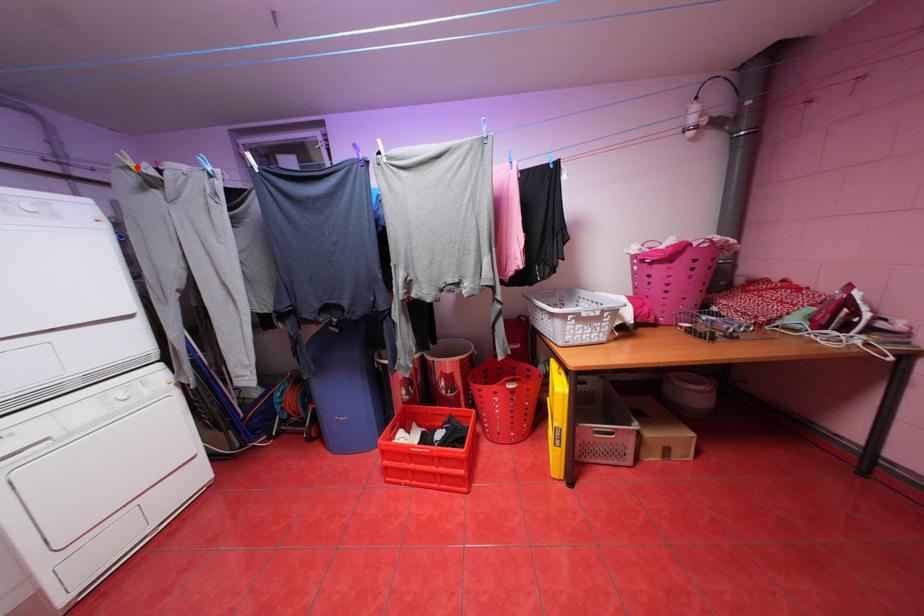
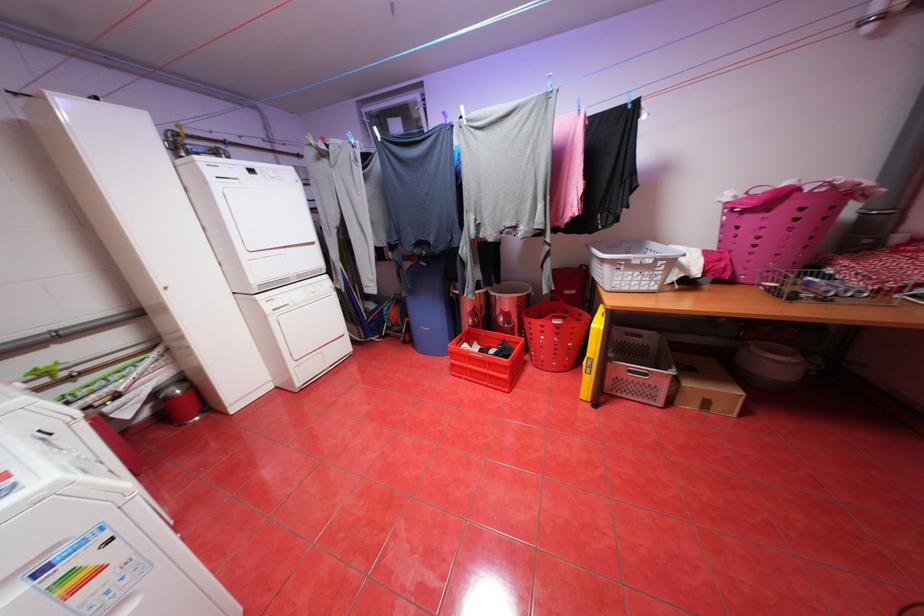
The point at the highlighted location is marked in the first image. Where is the corresponding point in the second image?

(320, 145)